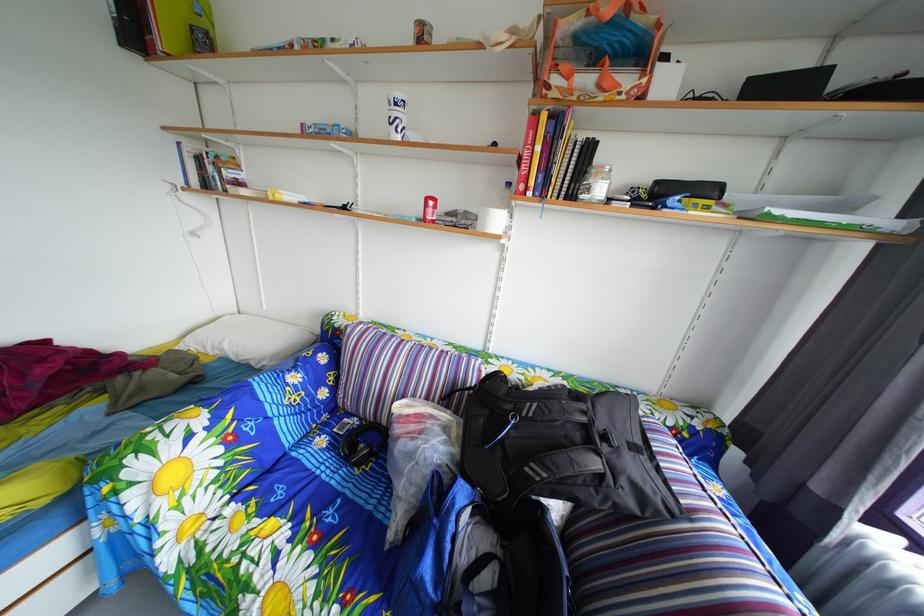
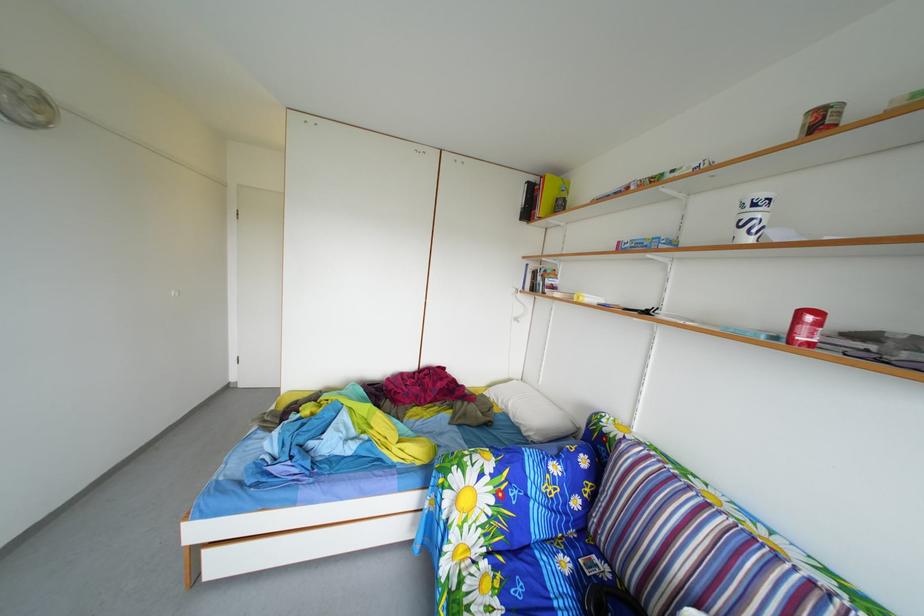
Question: The camera is either moving clockwise (left) or counter-clockwise (right) around the object. The first image is from the beginning of the video and the second image is from the end. Is the camera moving left or right when shooting the video?

Choices:
 (A) Left
 (B) Right

Answer: (B)